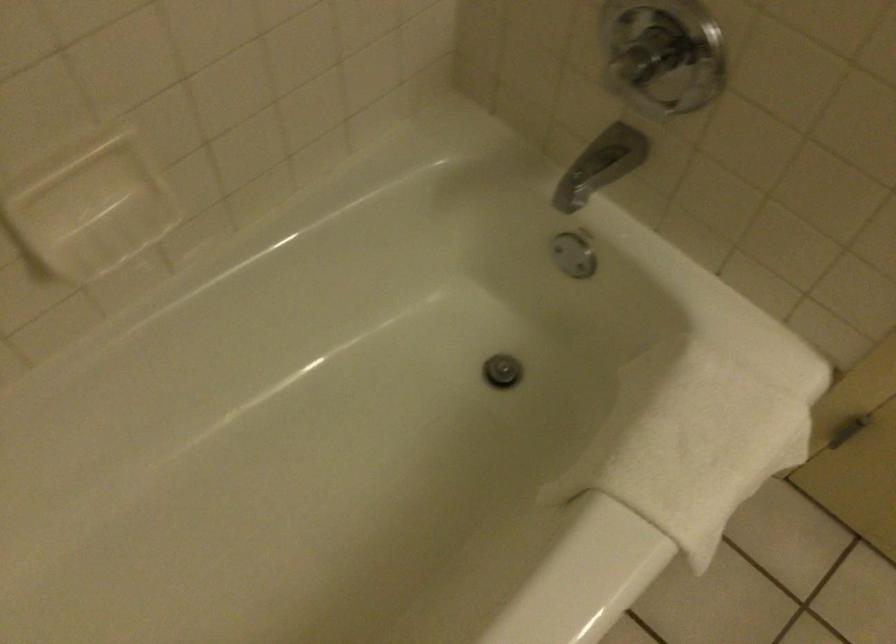
The image size is (896, 644). In order to click on drain control lever in this screenshot , I will do `click(586, 174)`.